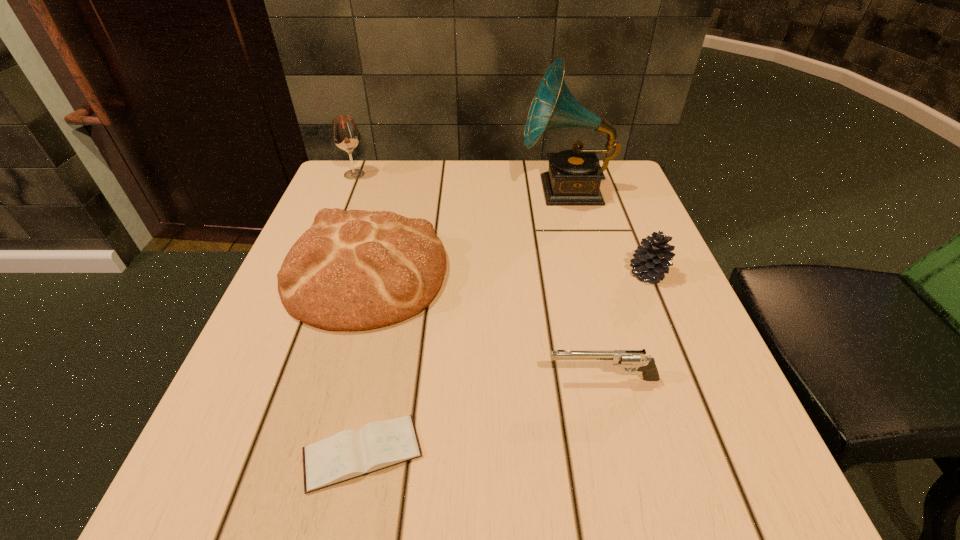
Locate an element on the screen. Image resolution: width=960 pixels, height=540 pixels. blank area located from the horn of the phonograph_record is located at coordinates (443, 190).

Identify the location of free space located on the right of the second tallest object. (426, 174).

The image size is (960, 540). Find the location of `free location located 0.200m on the back of the fourth shortest object`. free location located 0.200m on the back of the fourth shortest object is located at coordinates (394, 177).

Find the location of a particular element. vacant space located 0.160m on the left of the third shortest object is located at coordinates (545, 273).

Where is `vacant space located 0.400m on the front-facing side of the second shortest object`? vacant space located 0.400m on the front-facing side of the second shortest object is located at coordinates (286, 379).

This screenshot has height=540, width=960. Identify the location of free space located on the front-facing side of the second shortest object. (345, 379).

Find the location of a particular element. This screenshot has width=960, height=540. vacant region located 0.180m on the front-facing side of the second shortest object is located at coordinates (429, 379).

This screenshot has width=960, height=540. In order to click on free spot located 0.340m on the back of the diary in this screenshot , I will do `click(401, 261)`.

Image resolution: width=960 pixels, height=540 pixels. Find the location of `phonograph_record located in the far edge section of the desktop`. phonograph_record located in the far edge section of the desktop is located at coordinates (574, 176).

I want to click on wineglass at the far edge, so click(x=345, y=134).